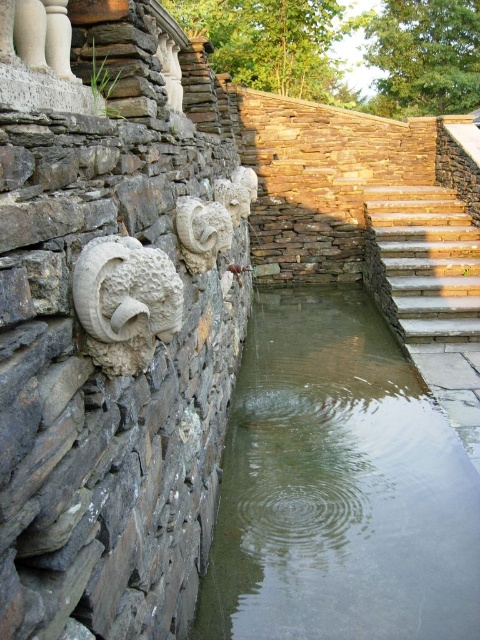
You are standing at the base of the stone wall and want to climb up to the top. You see the stone stairs at upper right and the gray stone ram head at left. Which one can you use to reach higher elevation?

The stone stairs at upper right can be used to reach higher elevation because it is larger in size than the gray stone ram head at left, suggesting it is more suitable for climbing.

You are standing at the base of the stone wall and want to reach the top of the stone stairs at upper right. There is a white stone ram at center in your path. Which object do you need to climb over or around to reach the stairs?

You need to climb over or around the white stone ram at center because it is shorter than the stone stairs at upper right, so it is in your path to reach the stairs.